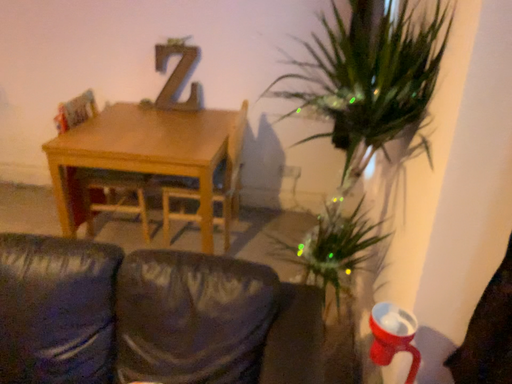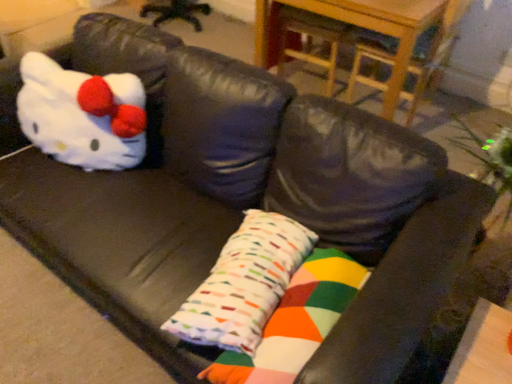
Question: How did the camera likely rotate when shooting the video?

Choices:
 (A) rotated left
 (B) rotated right

Answer: (A)